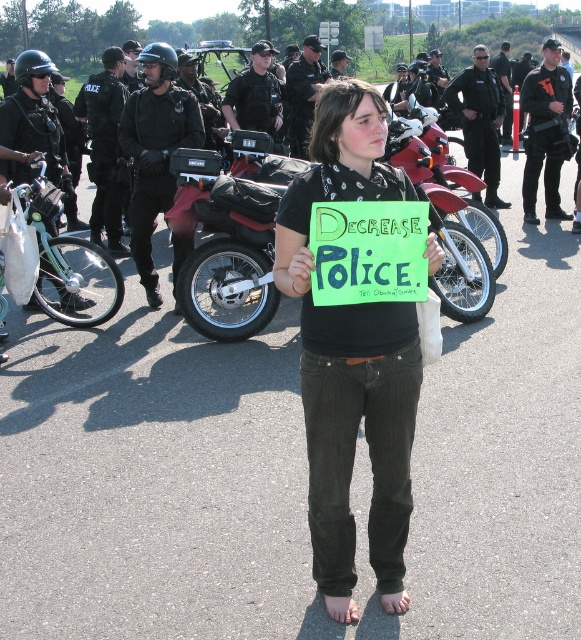
Is green paper sign at center to the right of white matte bicycle at left from the viewer's perspective?

Indeed, green paper sign at center is positioned on the right side of white matte bicycle at left.

Is green paper sign at center taller than white matte bicycle at left?

In fact, green paper sign at center may be shorter than white matte bicycle at left.

At what (x,y) coordinates should I click in order to perform the action: click on green paper sign at center. Please return your answer as a coordinate pair (x, y). The width and height of the screenshot is (581, 640). Looking at the image, I should click on (368, 252).

The width and height of the screenshot is (581, 640). I want to click on green paper sign at center, so click(x=368, y=252).

Between point (121, 54) and point (480, 140), which one is positioned behind?

The point (480, 140) is more distant.

Can you confirm if black uniformed police at left is positioned above black uniform at center?

Incorrect, black uniformed police at left is not positioned above black uniform at center.

Between point (87, 92) and point (471, 122), which one is positioned behind?

Point (471, 122)

Where is `black uniformed police at left`? The height and width of the screenshot is (640, 581). black uniformed police at left is located at coordinates (105, 147).

Who is positioned more to the right, black cotton shirt at center or black tactical vest at center?

black tactical vest at center

Can you confirm if black cotton shirt at center is taller than black tactical vest at center?

In fact, black cotton shirt at center may be shorter than black tactical vest at center.

This screenshot has width=581, height=640. Describe the element at coordinates (352, 358) in the screenshot. I see `black cotton shirt at center` at that location.

The width and height of the screenshot is (581, 640). I want to click on black cotton shirt at center, so click(x=352, y=358).